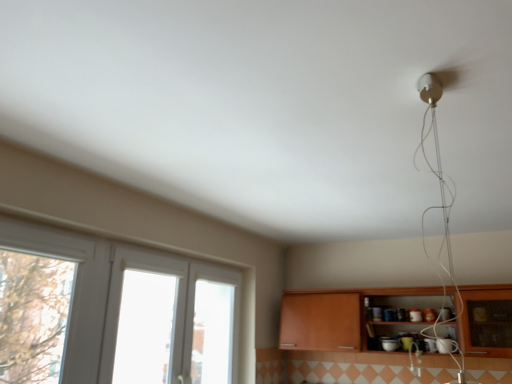
Question: In terms of width, does wooden cabinet at lower right look wider or thinner when compared to white plastic window at left?

Choices:
 (A) thin
 (B) wide

Answer: (B)

Question: From a real-world perspective, relative to white plastic window at left, is wooden cabinet at lower right vertically above or below?

Choices:
 (A) below
 (B) above

Answer: (B)

Question: From their relative heights in the image, would you say wooden cabinet at lower right is taller or shorter than white plastic window at left?

Choices:
 (A) tall
 (B) short

Answer: (B)

Question: Is point (39, 327) closer or farther from the camera than point (289, 316)?

Choices:
 (A) farther
 (B) closer

Answer: (B)

Question: Do you think white plastic window at left is within wooden cabinet at lower right, or outside of it?

Choices:
 (A) inside
 (B) outside

Answer: (B)

Question: Based on their sizes in the image, would you say white plastic window at left is bigger or smaller than wooden cabinet at lower right?

Choices:
 (A) small
 (B) big

Answer: (A)

Question: From a real-world perspective, relative to wooden cabinet at lower right, is white plastic window at left vertically above or below?

Choices:
 (A) below
 (B) above

Answer: (A)